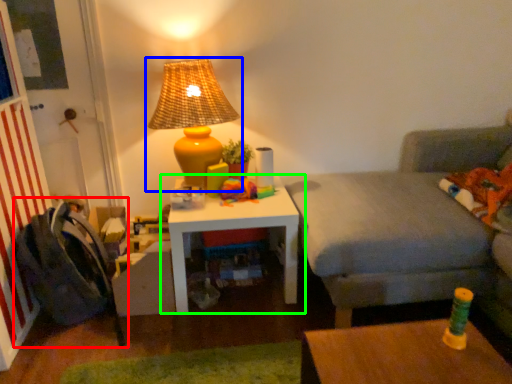
Question: Which object is the farthest from swivel chair (highlighted by a red box)? Choose among these: lamp (highlighted by a blue box) or table (highlighted by a green box).

Choices:
 (A) lamp
 (B) table

Answer: (A)